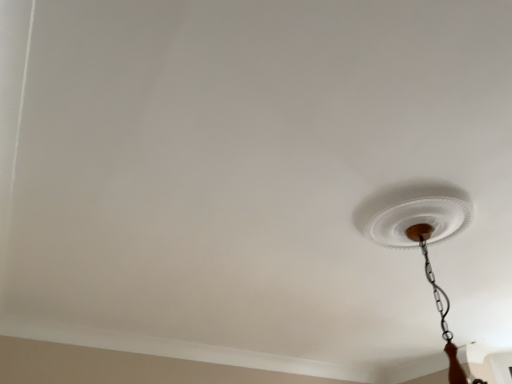
Question: Should I look upward or downward to see white plastic lamp at upper right?

Choices:
 (A) down
 (B) up

Answer: (A)